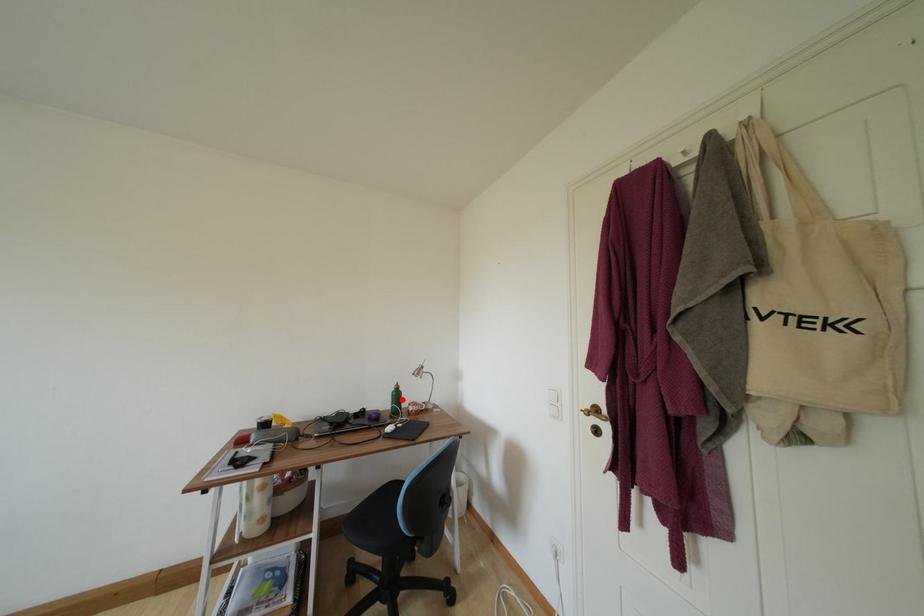
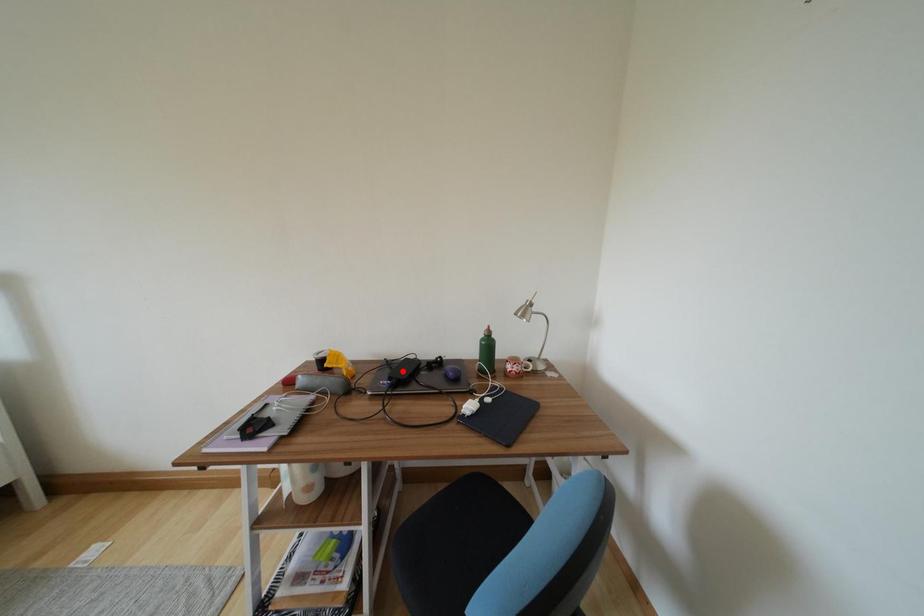
From the picture: I am providing you with two images of the same scene from different viewpoints. A red point is marked on the first image and another point is marked on the second image. Is the red point in image1 aligned with the point shown in image2?

No